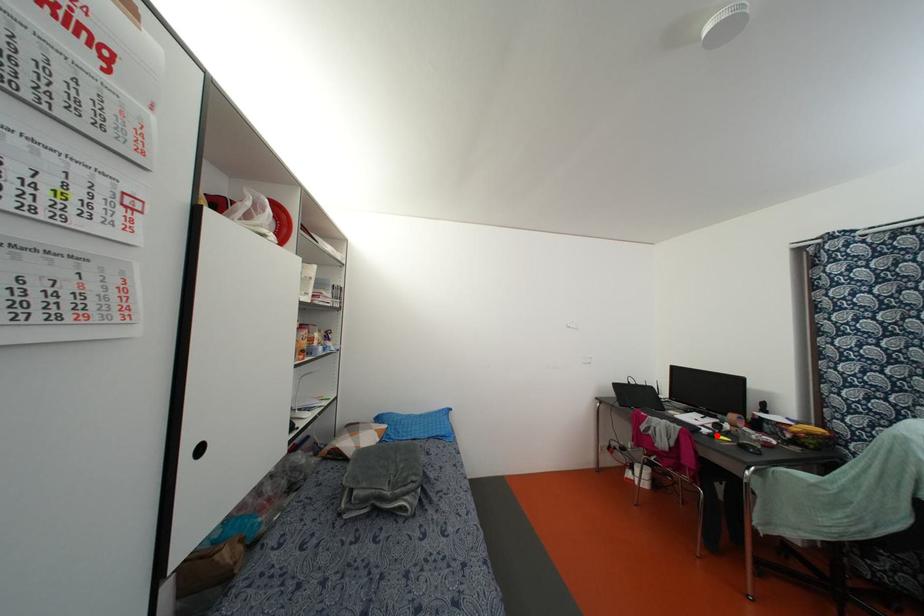
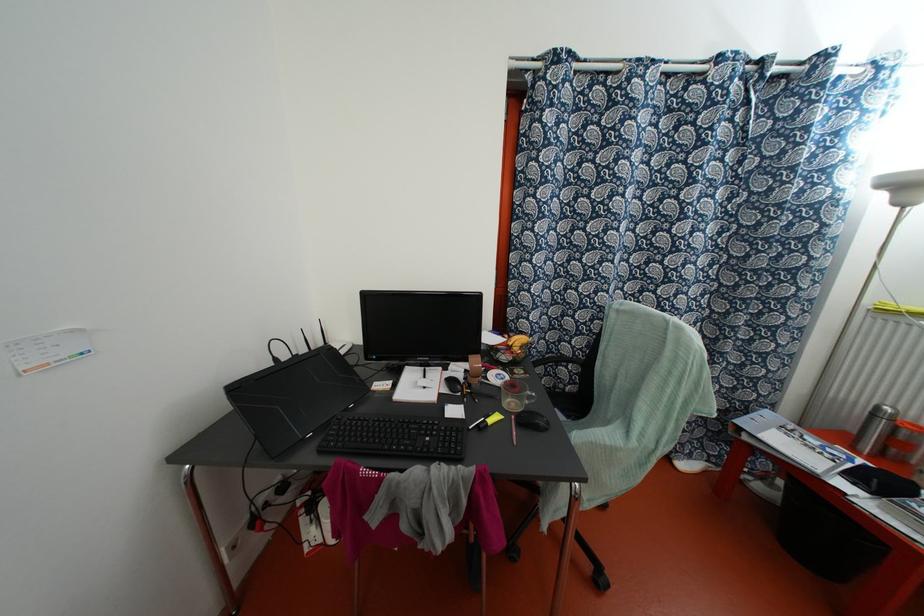
Locate, in the second image, the point that corresponds to the highlighted location in the first image.

(489, 421)